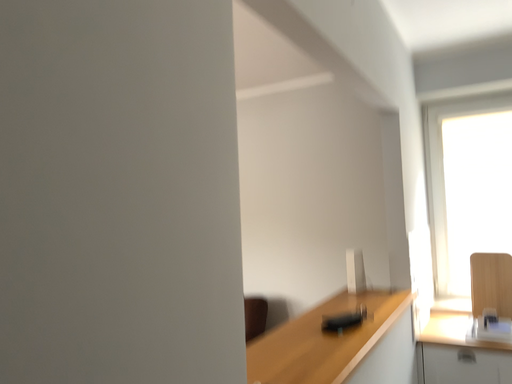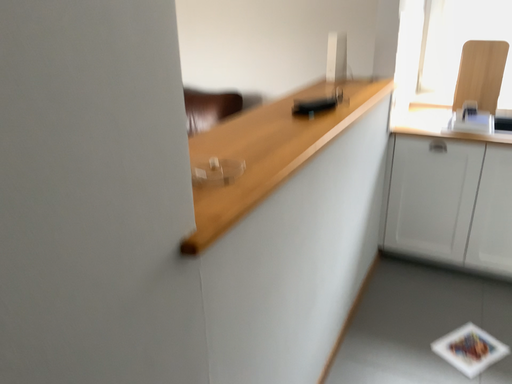
Question: Which way did the camera rotate in the video?

Choices:
 (A) rotated upward
 (B) rotated downward

Answer: (B)